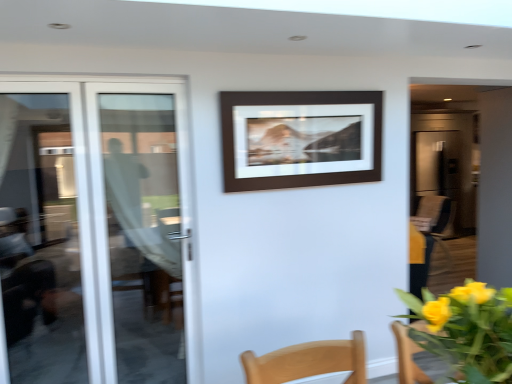
Question: From the image's perspective, is brown matte picture frame at center located beneath white glass door at left, positioned as the 2th door in right-to-left order?

Choices:
 (A) no
 (B) yes

Answer: (A)

Question: Does brown matte picture frame at center touch white glass door at left, positioned as the 2th door in right-to-left order?

Choices:
 (A) no
 (B) yes

Answer: (A)

Question: Is brown matte picture frame at center bigger than white glass door at left, acting as the first door starting from the left?

Choices:
 (A) yes
 (B) no

Answer: (B)

Question: Is brown matte picture frame at center oriented away from white glass door at left, positioned as the 2th door in right-to-left order?

Choices:
 (A) no
 (B) yes

Answer: (A)

Question: Is brown matte picture frame at center positioned beyond the bounds of white glass door at left, positioned as the 2th door in right-to-left order?

Choices:
 (A) yes
 (B) no

Answer: (A)

Question: From a real-world perspective, is brown matte picture frame at center positioned over white glass door at left, acting as the first door starting from the left, based on gravity?

Choices:
 (A) no
 (B) yes

Answer: (B)

Question: From the image's perspective, does yellow matte flowers at lower right appear lower than transparent glass door at left, arranged as the 2th door when viewed from the left?

Choices:
 (A) no
 (B) yes

Answer: (B)

Question: Is yellow matte flowers at lower right looking in the opposite direction of transparent glass door at left, which is the first door from right to left?

Choices:
 (A) yes
 (B) no

Answer: (B)

Question: Can you confirm if yellow matte flowers at lower right is thinner than transparent glass door at left, arranged as the 2th door when viewed from the left?

Choices:
 (A) no
 (B) yes

Answer: (A)

Question: From a real-world perspective, is yellow matte flowers at lower right under transparent glass door at left, arranged as the 2th door when viewed from the left?

Choices:
 (A) no
 (B) yes

Answer: (A)

Question: Is yellow matte flowers at lower right completely or partially outside of transparent glass door at left, which is the first door from right to left?

Choices:
 (A) no
 (B) yes

Answer: (B)

Question: From the image's perspective, is yellow matte flowers at lower right over transparent glass door at left, arranged as the 2th door when viewed from the left?

Choices:
 (A) yes
 (B) no

Answer: (B)

Question: Is white glass door at left, positioned as the 2th door in right-to-left order, at the left side of brown matte picture frame at center?

Choices:
 (A) no
 (B) yes

Answer: (B)